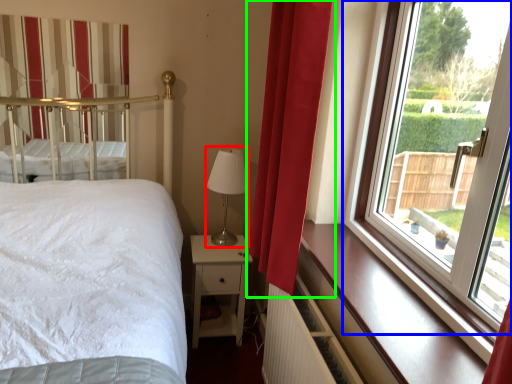
Question: Based on their relative distances, which object is nearer to table lamp (highlighted by a red box)? Choose from window (highlighted by a blue box) and curtain (highlighted by a green box).

Choices:
 (A) window
 (B) curtain

Answer: (B)